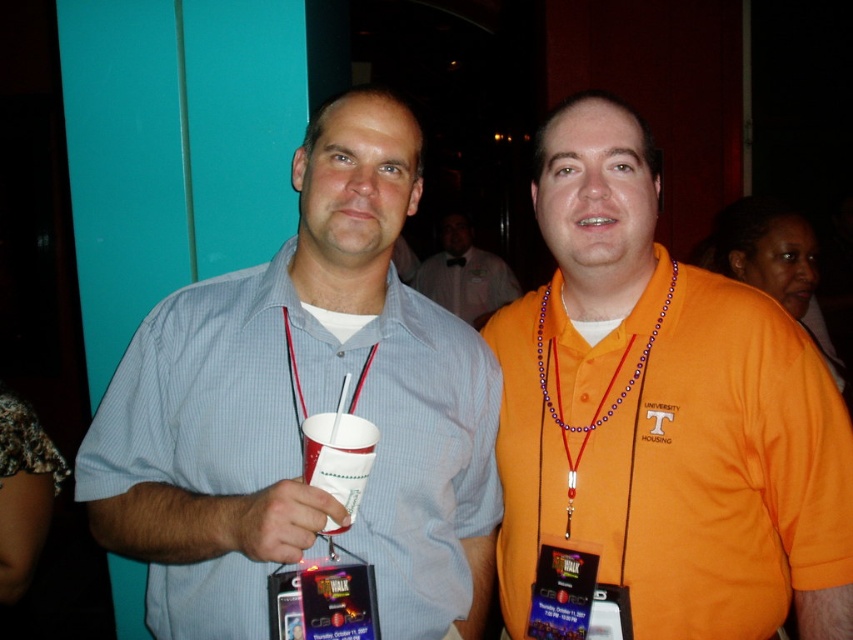
Question: Is white paper cup at center thinner than purple beaded necklace at center?

Choices:
 (A) no
 (B) yes

Answer: (B)

Question: Considering the relative positions of matte blue shirt at center and matte white shirt at center in the image provided, where is matte blue shirt at center located with respect to matte white shirt at center?

Choices:
 (A) left
 (B) right

Answer: (A)

Question: Estimate the real-world distances between objects in this image. Which object is farther from the white paper cup at center?

Choices:
 (A) orange cotton shirt at center
 (B) matte white shirt at center
 (C) purple beaded necklace at center

Answer: (B)

Question: Can you confirm if matte blue shirt at center is positioned to the left of white paper cup at center?

Choices:
 (A) no
 (B) yes

Answer: (B)

Question: Which point is farther to the camera?

Choices:
 (A) matte blue shirt at center
 (B) matte white shirt at center
 (C) purple beaded necklace at center

Answer: (B)

Question: Which point appears closest to the camera in this image?

Choices:
 (A) (612, 412)
 (B) (474, 268)
 (C) (663, 275)
 (D) (331, 321)

Answer: (D)